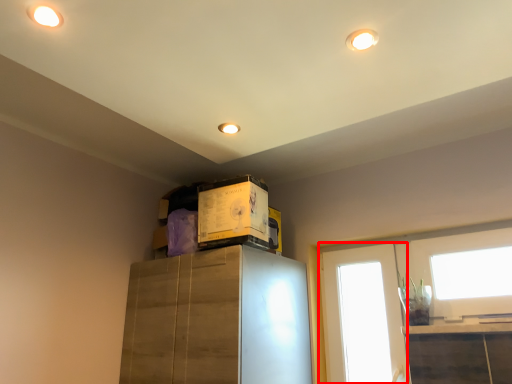
Question: Considering the relative positions of window (annotated by the red box) and box in the image provided, where is window (annotated by the red box) located with respect to the staircase?

Choices:
 (A) right
 (B) left

Answer: (A)